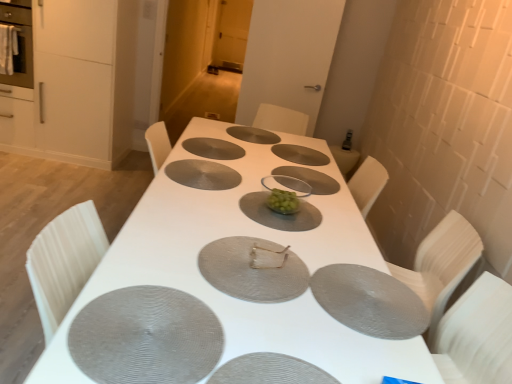
Where is `free area in between matte gray pizza pan at center, which appears as the sixth pizza pan when viewed from the front, and metallic silver pizza pan at center, positioned as the 5th pizza pan in back-to-front order`? Image resolution: width=512 pixels, height=384 pixels. free area in between matte gray pizza pan at center, which appears as the sixth pizza pan when viewed from the front, and metallic silver pizza pan at center, positioned as the 5th pizza pan in back-to-front order is located at coordinates (222, 193).